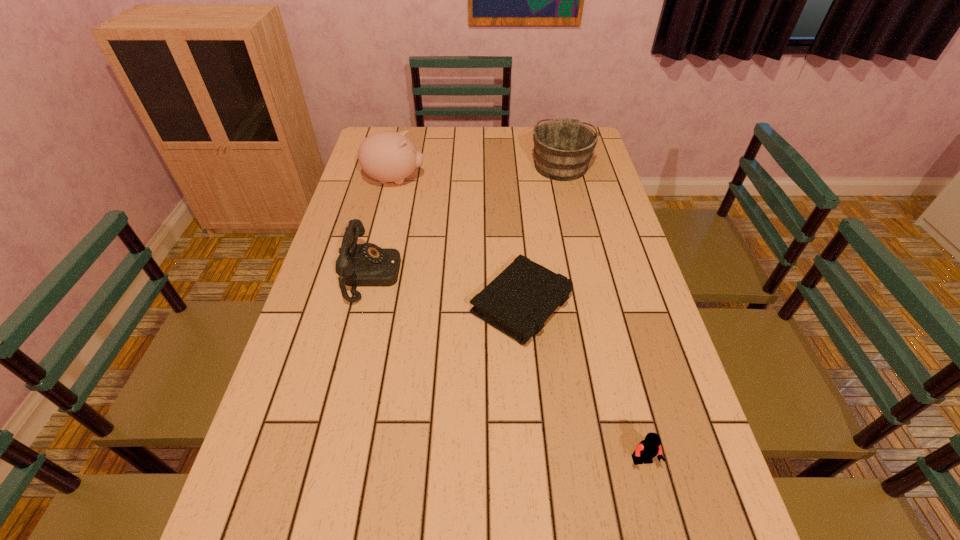
I want to click on the closest object to the Lego, so click(x=522, y=297).

Locate an element on the screen. This screenshot has height=540, width=960. free space that satisfies the following two spatial constraints: 1. on the back side of the wine bucket; 2. on the right side of the Bible is located at coordinates (510, 165).

Where is `vacant space that satisfies the following two spatial constraints: 1. on the back side of the shortest object; 2. on the dial of the telephone`? vacant space that satisfies the following two spatial constraints: 1. on the back side of the shortest object; 2. on the dial of the telephone is located at coordinates (519, 275).

Identify the location of free space that satisfies the following two spatial constraints: 1. on the dial of the telephone; 2. on the right side of the shortest object. The width and height of the screenshot is (960, 540). (365, 305).

Locate an element on the screen. free spot that satisfies the following two spatial constraints: 1. at the snout of the tallest object; 2. on the right side of the Bible is located at coordinates (365, 305).

Image resolution: width=960 pixels, height=540 pixels. Find the location of `free space that satisfies the following two spatial constraints: 1. on the back side of the shortest object; 2. at the snout of the tallest object`. free space that satisfies the following two spatial constraints: 1. on the back side of the shortest object; 2. at the snout of the tallest object is located at coordinates (511, 180).

You are a GUI agent. You are given a task and a screenshot of the screen. Output one action in this format:
    pyautogui.click(x=<x>, y=<y>)
    Task: Click on the vacant space that satisfies the following two spatial constraints: 1. on the back side of the shortest object; 2. at the snout of the tallest object
    The width and height of the screenshot is (960, 540).
    Given the screenshot: What is the action you would take?
    coord(511,180)

You are a GUI agent. You are given a task and a screenshot of the screen. Output one action in this format:
    pyautogui.click(x=<x>, y=<y>)
    Task: Click on the vacant space that satisfies the following two spatial constraints: 1. on the dial of the telephone; 2. on the right side of the shortest object
    The height and width of the screenshot is (540, 960).
    Given the screenshot: What is the action you would take?
    pyautogui.click(x=365, y=305)

What are the coordinates of `vacant space that satisfies the following two spatial constraints: 1. at the snout of the Bible; 2. on the right side of the tallest object` in the screenshot? It's located at (365, 305).

The image size is (960, 540). Find the location of `free space that satisfies the following two spatial constraints: 1. on the dial of the telephone; 2. on the left side of the Bible`. free space that satisfies the following two spatial constraints: 1. on the dial of the telephone; 2. on the left side of the Bible is located at coordinates (365, 305).